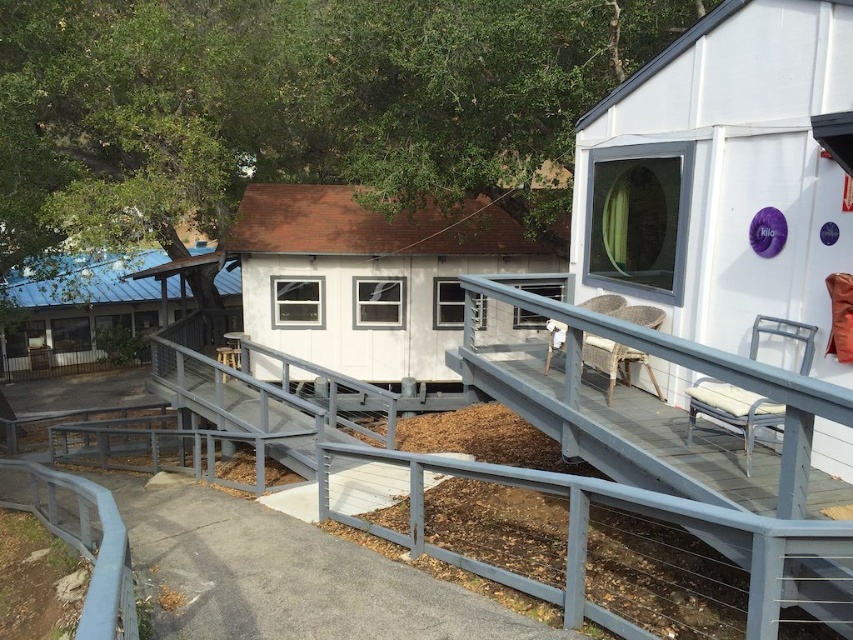
Who is lower down, white matte hut at upper right or blue corrugated metal hut at left?

white matte hut at upper right is lower down.

Which is more to the right, white matte hut at upper right or blue corrugated metal hut at left?

Positioned to the right is white matte hut at upper right.

Does point (595, 106) come behind point (79, 317)?

No.

Find the location of a particular element. white matte hut at upper right is located at coordinates (724, 172).

Who is shorter, gray metal rail at center or white wood cabin at center?

Standing shorter between the two is gray metal rail at center.

Between gray metal rail at center and white wood cabin at center, which one is positioned higher?

white wood cabin at center is above.

Between point (836, 556) and point (376, 294), which one is positioned behind?

Point (376, 294)

You are a GUI agent. You are given a task and a screenshot of the screen. Output one action in this format:
    pyautogui.click(x=<x>, y=<y>)
    Task: Click on the gray metal rail at center
    
    Given the screenshot: What is the action you would take?
    pyautogui.click(x=653, y=412)

Does point (593, 209) come behind point (459, 276)?

No, it is not.

Does white matte hut at upper right have a lesser width compared to gray metal rail at center?

Yes, white matte hut at upper right is thinner than gray metal rail at center.

The image size is (853, 640). Describe the element at coordinates (724, 172) in the screenshot. I see `white matte hut at upper right` at that location.

Find the location of a particular element. white matte hut at upper right is located at coordinates (724, 172).